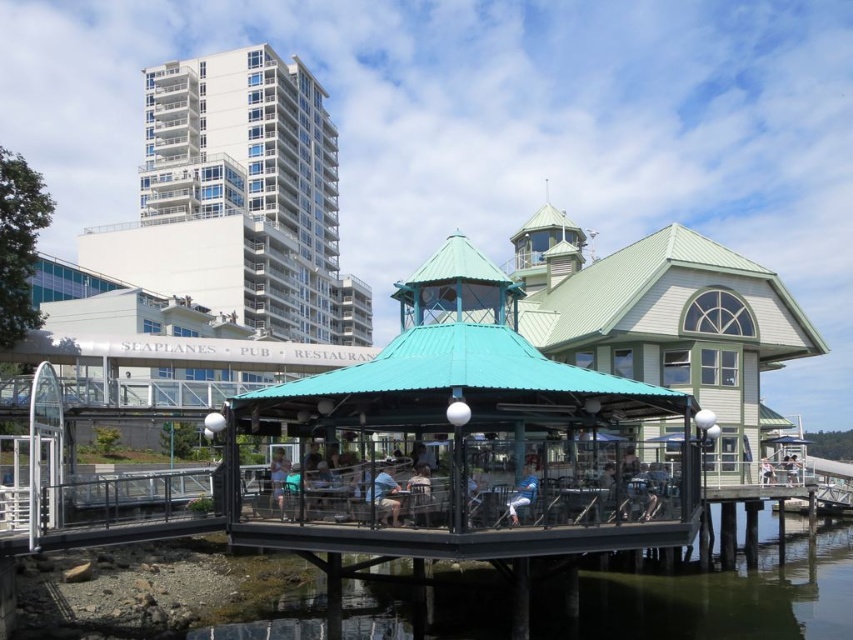
You are a photographer standing at the waterfront scene. You want to take a photo of the light blue fabric shirt at center and the light blue fabric umbrella at center. Which object should you focus on first to ensure it appears in the foreground of your photo?

The light blue fabric shirt at center should be focused on first because it is in front of the light blue fabric umbrella at center, making it naturally appear in the foreground.

You are standing at the camera position. The light blue fabric shirt at center is part of a person you want to photograph. Can you capture the entire shirt in your photo without moving the camera or the shirt?

The light blue fabric shirt at center and camera are 17.07 meters apart. Since the distance is significant, it might be challenging to capture the entire shirt in the photo without zooming or adjusting the camera angle. However, if the camera has a wide enough lens or zoom capability, it could be possible. The answer depends on the camera equipment available.